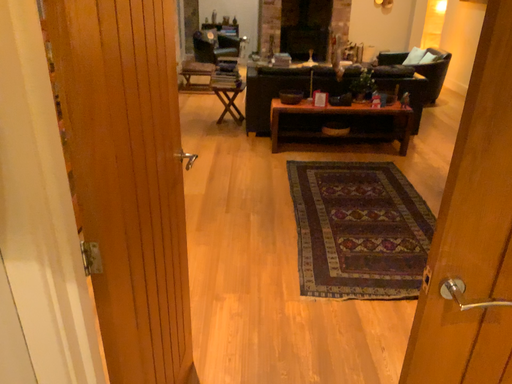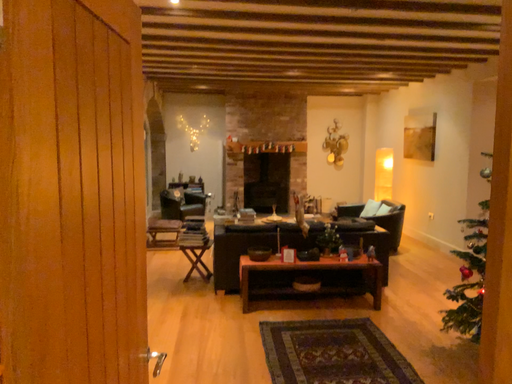
Question: How did the camera likely rotate when shooting the video?

Choices:
 (A) rotated downward
 (B) rotated upward

Answer: (B)